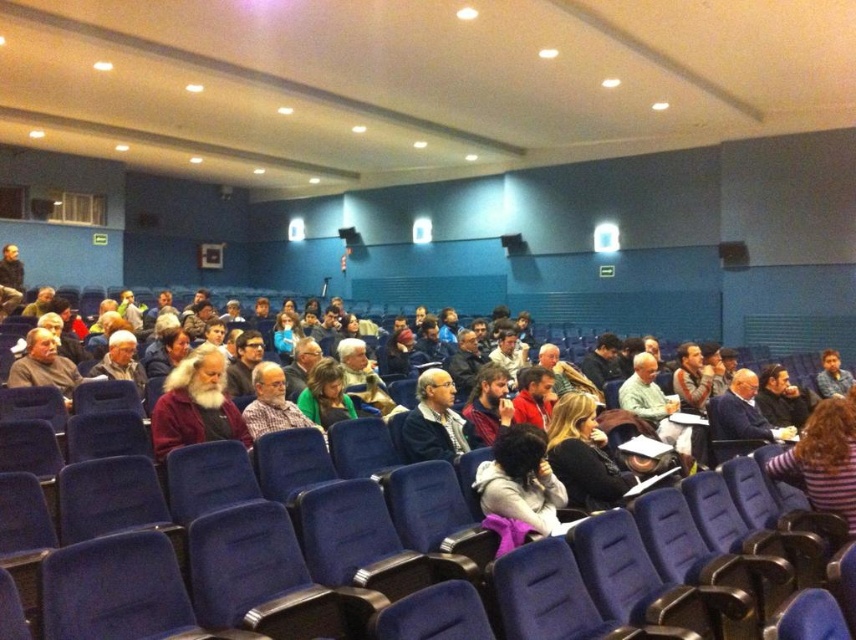
Who is lower down, dark purple sweater at center or gray wool sweater at center?

dark purple sweater at center is lower down.

Who is positioned more to the right, dark purple sweater at center or gray wool sweater at center?

dark purple sweater at center

What do you see at coordinates (520, 481) in the screenshot? I see `dark purple sweater at center` at bounding box center [520, 481].

I want to click on dark purple sweater at center, so click(520, 481).

Does dark purple sweater at center have a greater height compared to light brown hair at center?

No.

In order to click on dark purple sweater at center in this screenshot , I will do `click(520, 481)`.

What are the coordinates of `dark purple sweater at center` in the screenshot? It's located at (520, 481).

Which of these two, dark purple sweater at center or bearded man at center, stands taller?

Standing taller between the two is bearded man at center.

Between point (497, 483) and point (504, 413), which one is positioned in front?

Point (497, 483)

Measure the distance between dark purple sweater at center and camera.

dark purple sweater at center is 3.07 meters from camera.

Find the location of a particular element. The width and height of the screenshot is (856, 640). dark purple sweater at center is located at coordinates (x=520, y=481).